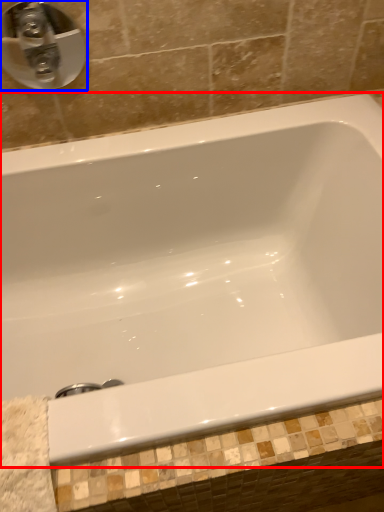
Question: Which object is further to the camera taking this photo, bathtub (highlighted by a red box) or tap (highlighted by a blue box)?

Choices:
 (A) bathtub
 (B) tap

Answer: (B)